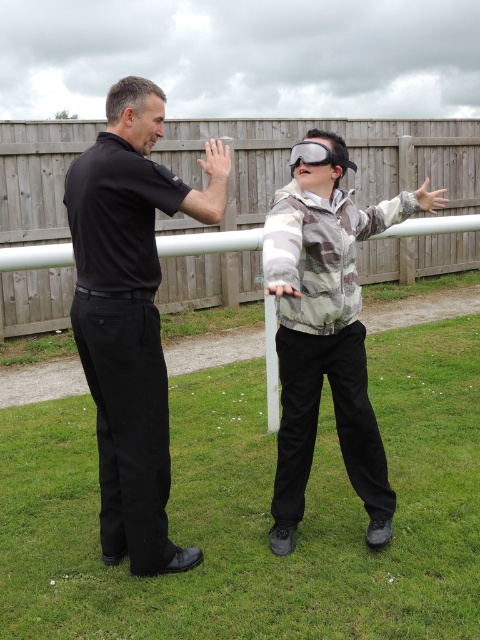
You are standing at the point labeled point (82, 168) and want to walk towards the wooden fence in the background. Is the point labeled point (23, 298) in your path?

Yes, the point labeled point (23, 298) is behind point (82, 168), so it is in your path towards the wooden fence.

You are standing at the center of the grassy area and want to know the exact location of the black smooth shirt at left. Can you tell me its coordinates?

The black smooth shirt at left is located at coordinates point [131,316].

You are standing at the viewpoint of the image and want to reach the point marked at coordinates (384, 164). If your walking speed is 1.2 meters per second, how many seconds will it take you to reach that point?

The point at coordinates (384, 164) is 10.46 meters away from the viewer. At a walking speed of 1.2 meters per second, it would take approximately 8.72 seconds to reach it.